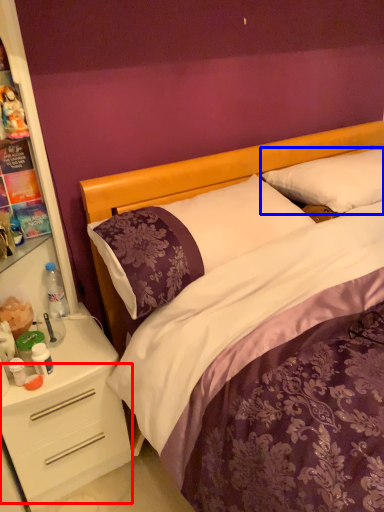
Question: Which object is further to the camera taking this photo, drawer (highlighted by a red box) or pillow (highlighted by a blue box)?

Choices:
 (A) drawer
 (B) pillow

Answer: (B)